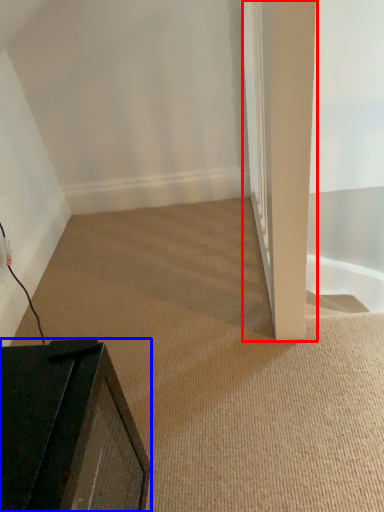
Question: Which of the following is the closest to the observer, pillar (highlighted by a red box) or furniture (highlighted by a blue box)?

Choices:
 (A) pillar
 (B) furniture

Answer: (B)